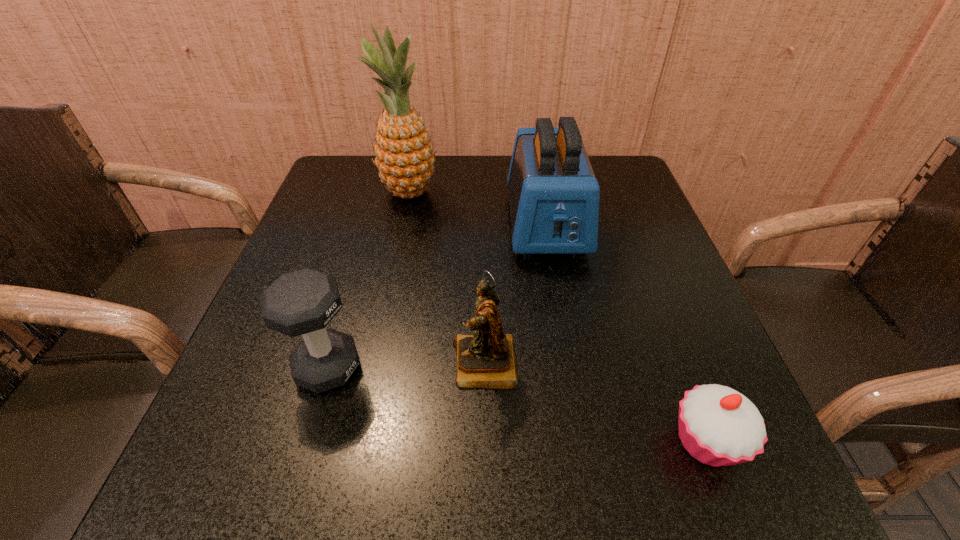
The image size is (960, 540). What are the coordinates of `free point located 0.100m on the front-facing side of the third object from right to left` in the screenshot? It's located at (394, 364).

The image size is (960, 540). Find the location of `vacant area situated on the front-facing side of the third object from right to left`. vacant area situated on the front-facing side of the third object from right to left is located at coordinates (334, 364).

Locate an element on the screen. The width and height of the screenshot is (960, 540). blank space located on the back of the dumbbell is located at coordinates (368, 233).

Where is `free spot located on the left of the cupcake`? This screenshot has height=540, width=960. free spot located on the left of the cupcake is located at coordinates (471, 442).

Identify the location of pineapple at the far edge. The height and width of the screenshot is (540, 960). tap(404, 152).

Locate an element on the screen. toaster that is at the far edge is located at coordinates (554, 196).

Where is `object that is at the near edge`? The height and width of the screenshot is (540, 960). object that is at the near edge is located at coordinates (718, 426).

What are the coordinates of `pineapple situated at the left edge` in the screenshot? It's located at (404, 152).

Image resolution: width=960 pixels, height=540 pixels. I want to click on dumbbell at the left edge, so pos(303,302).

Locate an element on the screen. object that is at the right edge is located at coordinates (718, 426).